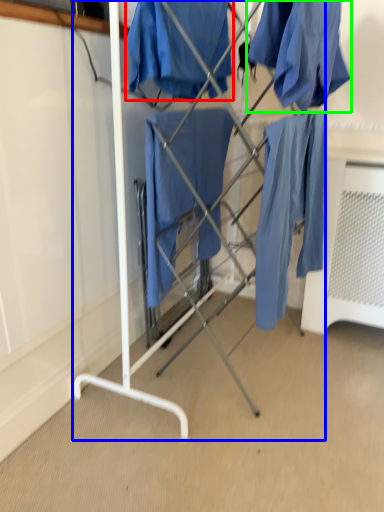
Question: Which object is positioned farthest from clothing (highlighted by a red box)? Select from furniture (highlighted by a blue box) and clothing (highlighted by a green box).

Choices:
 (A) furniture
 (B) clothing

Answer: (A)